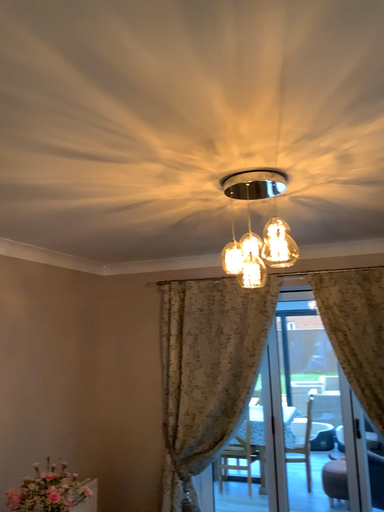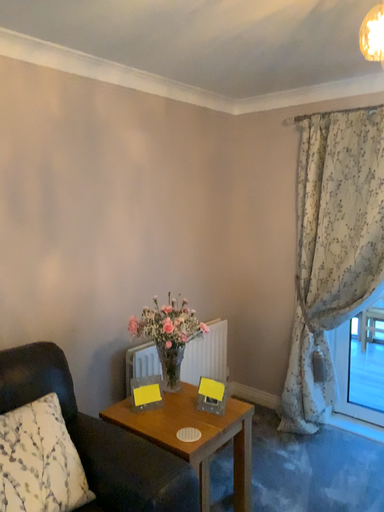
Question: Which way did the camera rotate in the video?

Choices:
 (A) rotated right
 (B) rotated left

Answer: (B)